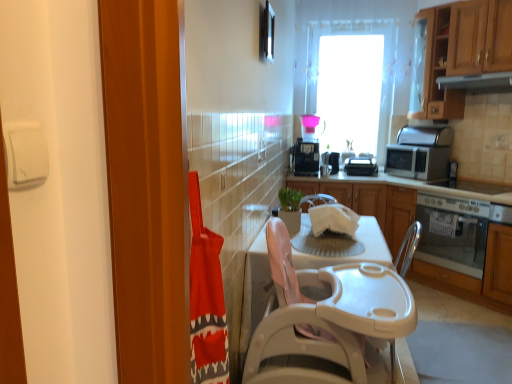
What are the coordinates of `unoccupied area in front of white plastic toaster at center, which is the second appliance in right-to-left order` in the screenshot? It's located at (369, 175).